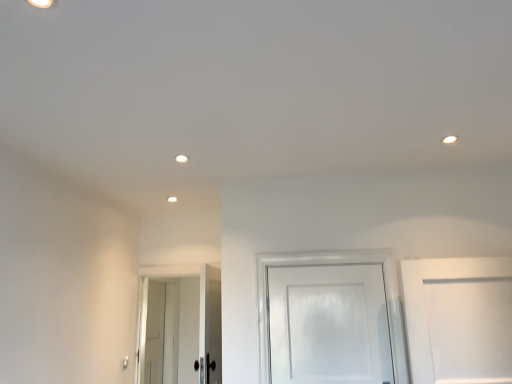
Question: Does point (217, 337) appear closer or farther from the camera than point (379, 359)?

Choices:
 (A) closer
 (B) farther

Answer: (B)

Question: Would you say white glossy door at lower left, the 2th door in the front-to-back sequence, is to the left or to the right of white glossy door at center, the first door viewed from the right, in the picture?

Choices:
 (A) right
 (B) left

Answer: (B)

Question: Estimate the real-world distances between objects in this image. Which object is farther from the white glossy door at center, the first door viewed from the right?

Choices:
 (A) white glossy door at lower left, the 2th door in the front-to-back sequence
 (B) white glossy door at lower left, marked as the first door in a back-to-front arrangement

Answer: (B)

Question: Based on their relative distances, which object is nearer to the white glossy door at center, which appears as the 1th door when viewed from the front?

Choices:
 (A) white glossy door at lower left, the 2th door in the front-to-back sequence
 (B) white glossy door at lower left, the third door when ordered from front to back

Answer: (A)